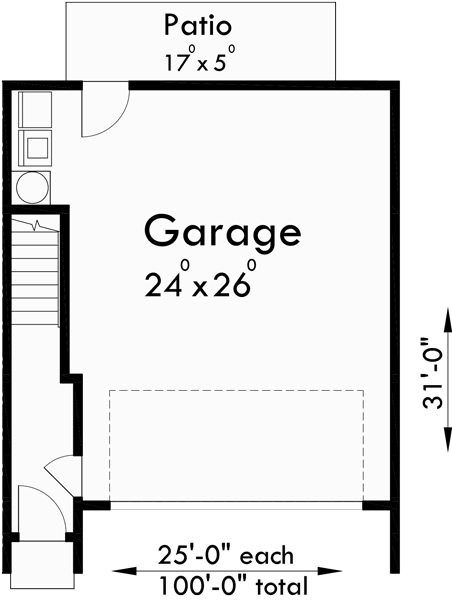
At what (x,y) coordinates should I click in order to perform the action: click on door width. Please return your answer as a coordinate pair (x, y). Looking at the image, I should click on (304, 507).